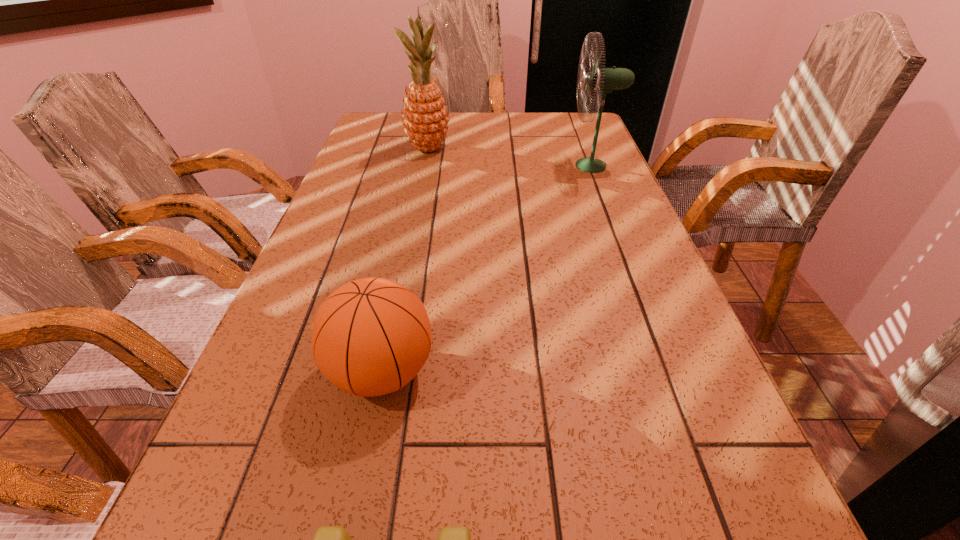
Where is `pineapple that is positioned at the left edge`? pineapple that is positioned at the left edge is located at coordinates tap(425, 118).

Find the location of `basketball that is at the left edge`. basketball that is at the left edge is located at coordinates (370, 337).

Image resolution: width=960 pixels, height=540 pixels. I want to click on object present at the right edge, so click(x=602, y=80).

Find the location of a particular element. This screenshot has height=540, width=960. object present at the far left corner is located at coordinates [425, 118].

In the image, there is a desktop. Where is `vacant space at the left edge`? The image size is (960, 540). vacant space at the left edge is located at coordinates tap(248, 521).

In the image, there is a desktop. Find the location of `vacant area at the right edge`. vacant area at the right edge is located at coordinates (771, 503).

Find the location of a particular element. The image size is (960, 540). free space at the far left corner of the desktop is located at coordinates (402, 138).

Find the location of a particular element. The height and width of the screenshot is (540, 960). vacant region between the pineapple and the fan is located at coordinates (510, 157).

The width and height of the screenshot is (960, 540). What are the coordinates of `vacant area that lies between the second shortest object and the pineapple` in the screenshot? It's located at (405, 260).

Where is `vacant space that's between the fan and the second nearest object`? vacant space that's between the fan and the second nearest object is located at coordinates (487, 268).